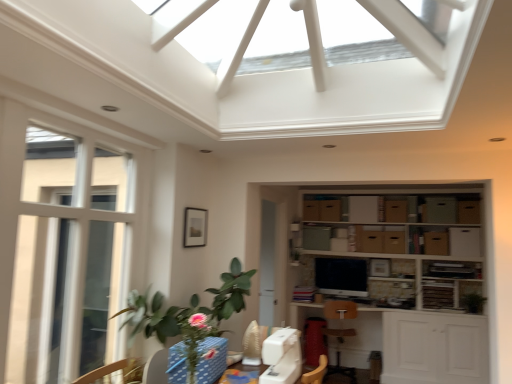
Identify the location of vacant space situated above brown cardboard cabinet at upper center, arranged as the 2th cabinetry when viewed from the right (from a real-world perspective). The width and height of the screenshot is (512, 384). (399, 193).